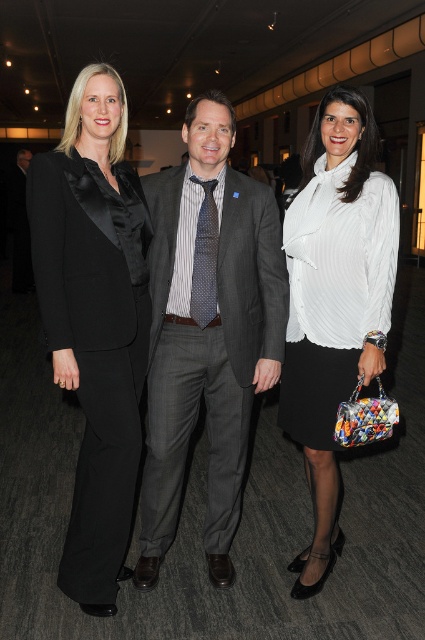
Does polka dot silk tie at center lie in front of dark gray suit at center?

Yes, it is.

Is polka dot silk tie at center to the left of dark gray suit at center from the viewer's perspective?

No, polka dot silk tie at center is not to the left of dark gray suit at center.

The image size is (425, 640). What do you see at coordinates (204, 257) in the screenshot?
I see `polka dot silk tie at center` at bounding box center [204, 257].

Find the location of a particular element. The image size is (425, 640). polka dot silk tie at center is located at coordinates (204, 257).

Does point (280, 396) come behind point (25, 209)?

No, (280, 396) is closer to viewer.

Can you confirm if white pleated blouse at center is positioned above dark gray suit at center?

Actually, white pleated blouse at center is below dark gray suit at center.

Does point (368, 131) lie behind point (11, 202)?

That is False.

Identify the location of white pleated blouse at center. (334, 301).

Is point (119, 186) positioned before point (286, 248)?

Yes.

Is black satin suit at left taller than white pleated blouse at center?

In fact, black satin suit at left may be shorter than white pleated blouse at center.

Who is more distant from viewer, (95, 572) or (302, 339)?

Positioned behind is point (302, 339).

Locate an element on the screen. The image size is (425, 640). black satin suit at left is located at coordinates (95, 346).